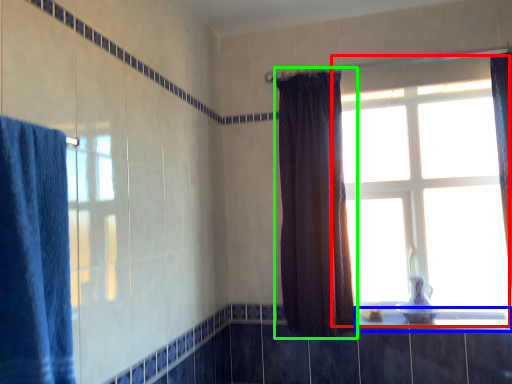
Question: Estimate the real-world distances between objects in this image. Which object is closer to window (highlighted by a red box), window sill (highlighted by a blue box) or curtain (highlighted by a green box)?

Choices:
 (A) window sill
 (B) curtain

Answer: (B)